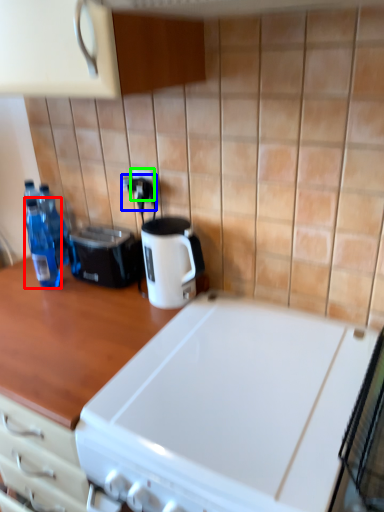
Question: Estimate the real-world distances between objects in this image. Which object is farther from bottle (highlighted by a red box), electric outlet (highlighted by a blue box) or electric outlet (highlighted by a green box)?

Choices:
 (A) electric outlet
 (B) electric outlet

Answer: (B)